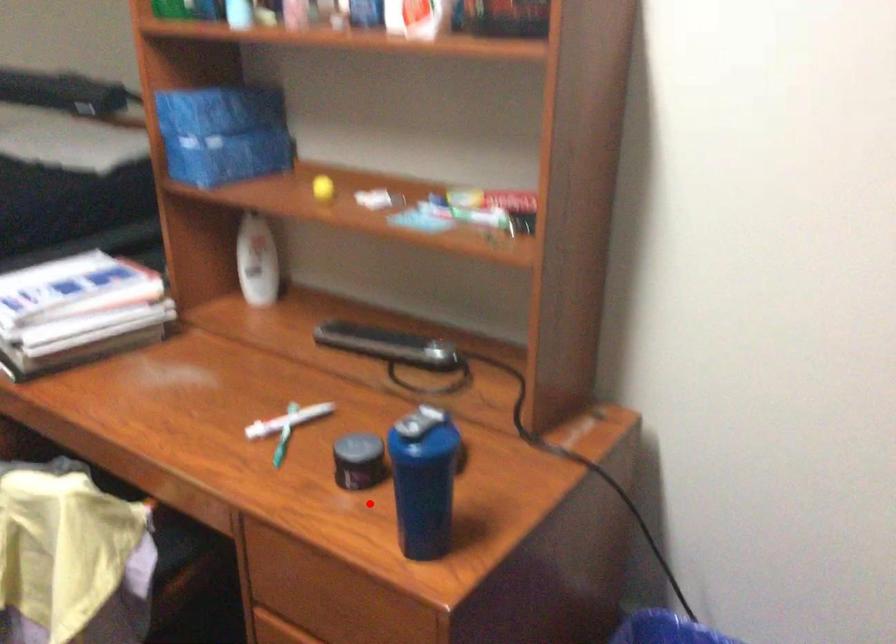
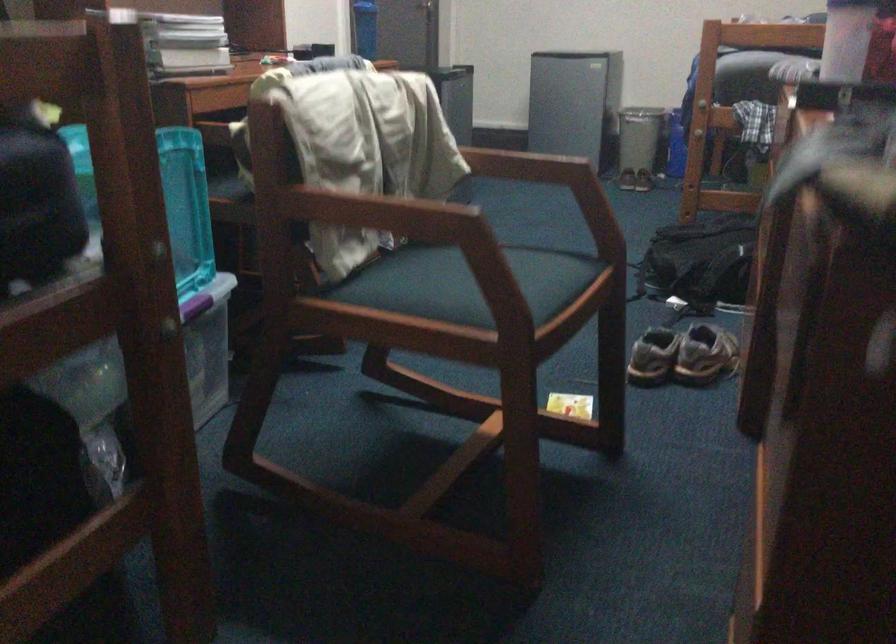
In the second image, find the point that corresponds to the highlighted location in the first image.

(365, 28)